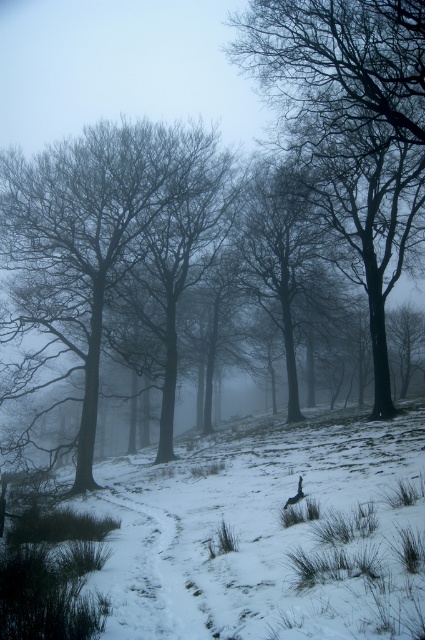
Question: Is silvery bark trees at center positioned at the back of snowy dirt path at center?

Choices:
 (A) no
 (B) yes

Answer: (B)

Question: Does smooth bark tree at center appear on the right side of silvery bark trees at center?

Choices:
 (A) no
 (B) yes

Answer: (B)

Question: Among these points, which one is farthest from the camera?

Choices:
 (A) (320, 0)
 (B) (175, 627)

Answer: (A)

Question: Which point is farther from the camera taking this photo?

Choices:
 (A) (300, 481)
 (B) (133, 531)
 (C) (45, 262)
 (D) (414, 65)

Answer: (C)

Question: Which object appears closest to the camera in this image?

Choices:
 (A) dark brown feathers at center
 (B) silvery bark trees at center
 (C) snowy dirt path at center

Answer: (C)

Question: Is silvery bark trees at center behind snowy dirt path at center?

Choices:
 (A) no
 (B) yes

Answer: (B)